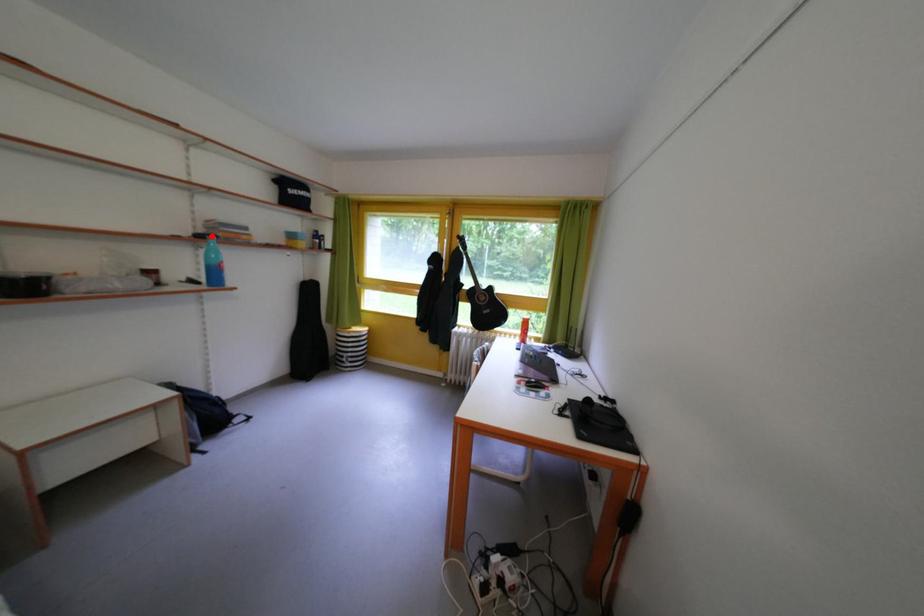
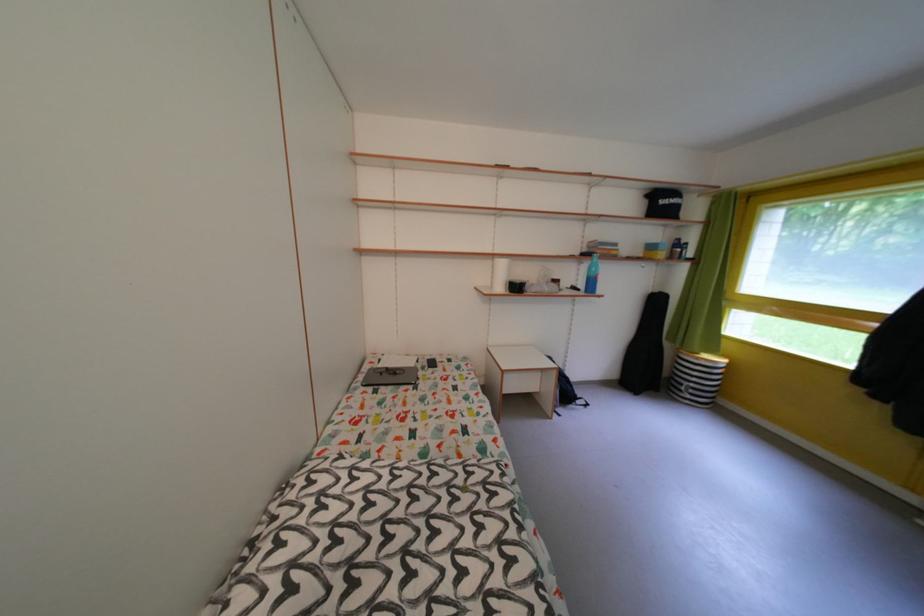
Locate, in the second image, the point that corresponds to the highlighted location in the first image.

(594, 256)